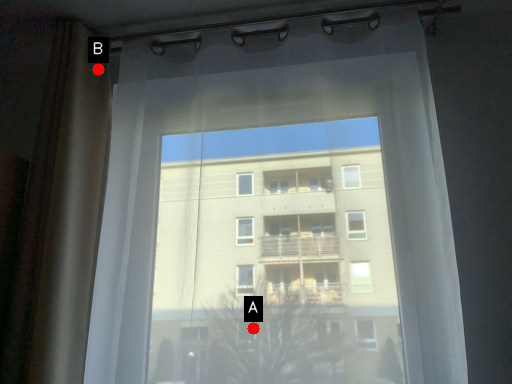
Question: Two points are circled on the image, labeled by A and B beside each circle. Which point is closer to the camera?

Choices:
 (A) A is closer
 (B) B is closer

Answer: (A)